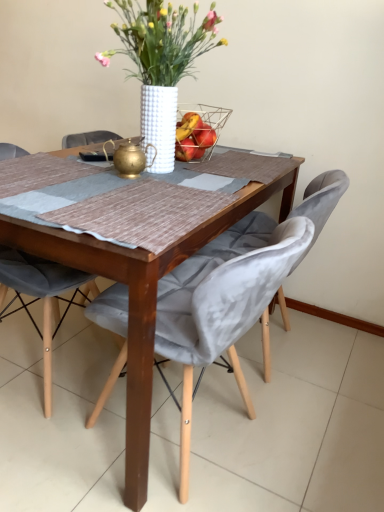
Question: From a real-world perspective, is wire mesh basket at center positioned under wooden table at center based on gravity?

Choices:
 (A) yes
 (B) no

Answer: (B)

Question: Is wire mesh basket at center facing away from wooden table at center?

Choices:
 (A) no
 (B) yes

Answer: (A)

Question: Is wire mesh basket at center wider than wooden table at center?

Choices:
 (A) no
 (B) yes

Answer: (A)

Question: Is wire mesh basket at center facing towards wooden table at center?

Choices:
 (A) no
 (B) yes

Answer: (A)

Question: From a real-world perspective, is wire mesh basket at center physically above wooden table at center?

Choices:
 (A) yes
 (B) no

Answer: (A)

Question: In terms of height, does wooden table at center look taller or shorter compared to white textured vase at center?

Choices:
 (A) short
 (B) tall

Answer: (B)

Question: In terms of width, does wooden table at center look wider or thinner when compared to white textured vase at center?

Choices:
 (A) thin
 (B) wide

Answer: (B)

Question: Considering the positions of wooden table at center and white textured vase at center in the image, is wooden table at center bigger or smaller than white textured vase at center?

Choices:
 (A) small
 (B) big

Answer: (B)

Question: From a real-world perspective, is wooden table at center positioned above or below white textured vase at center?

Choices:
 (A) above
 (B) below

Answer: (B)

Question: Considering the positions of point (228, 116) and point (195, 17), is point (228, 116) closer or farther from the camera than point (195, 17)?

Choices:
 (A) farther
 (B) closer

Answer: (A)

Question: Would you say wire mesh basket at center is inside or outside white textured vase at center?

Choices:
 (A) outside
 (B) inside

Answer: (B)

Question: Based on their sizes in the image, would you say wire mesh basket at center is bigger or smaller than white textured vase at center?

Choices:
 (A) small
 (B) big

Answer: (A)

Question: From a real-world perspective, is wire mesh basket at center above or below white textured vase at center?

Choices:
 (A) below
 (B) above

Answer: (A)

Question: Considering the positions of velvet grey chair at center, which is the first chair in left-to-right order, and wooden table at center in the image, is velvet grey chair at center, which is the first chair in left-to-right order, taller or shorter than wooden table at center?

Choices:
 (A) short
 (B) tall

Answer: (B)

Question: From the image's perspective, is velvet grey chair at center, which is the first chair in left-to-right order, above or below wooden table at center?

Choices:
 (A) below
 (B) above

Answer: (A)